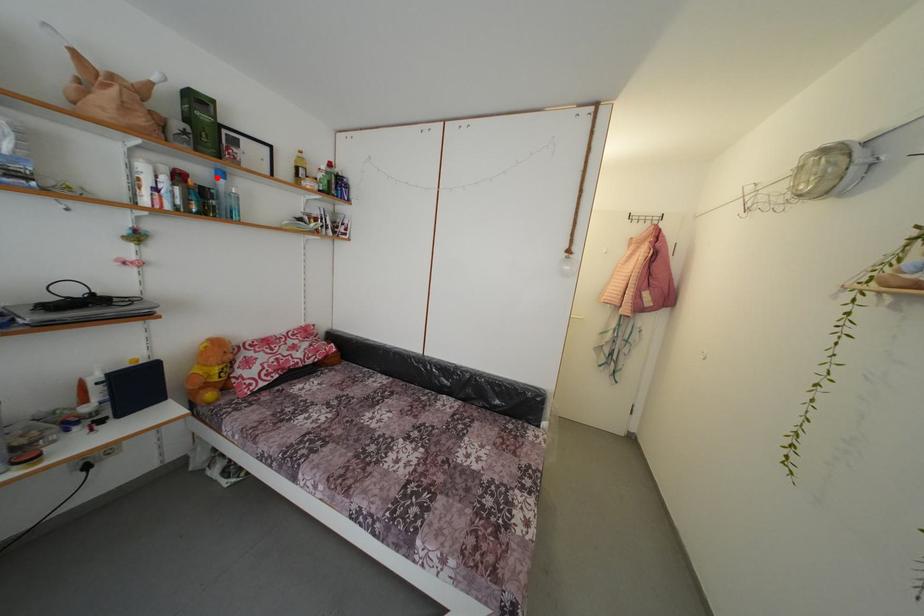
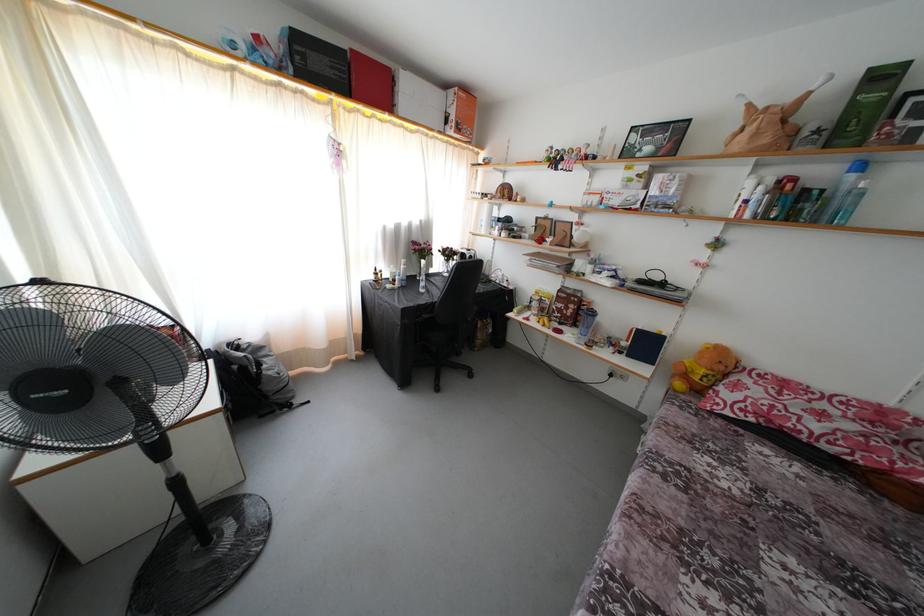
Locate, in the second image, the point that corresponds to the highlighted location in the first image.

(849, 172)